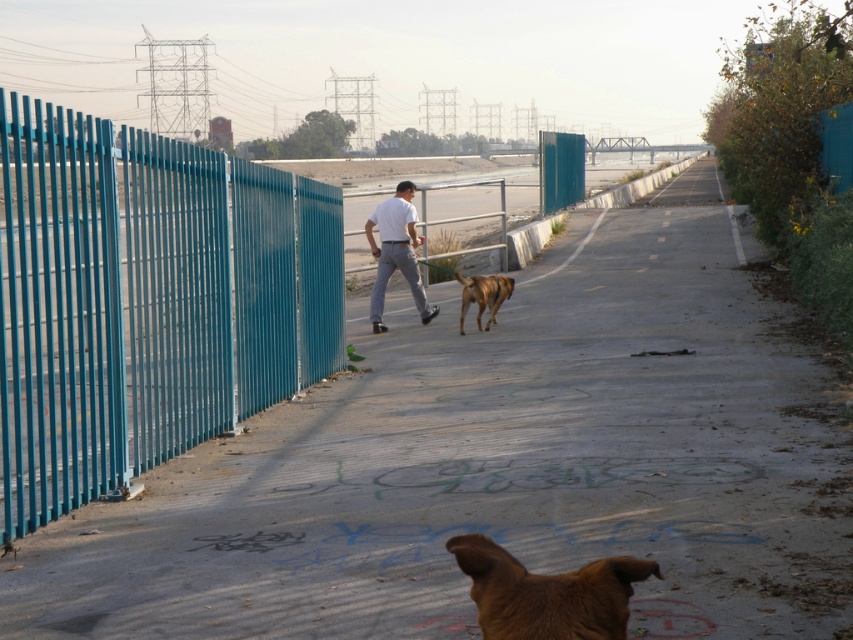
Question: Among these objects, which one is nearest to the camera?

Choices:
 (A) brown furry dog at lower center
 (B) brown fur dog at center

Answer: (A)

Question: Does metallic blue fence at left have a greater width compared to brown furry dog at lower center?

Choices:
 (A) no
 (B) yes

Answer: (A)

Question: Considering the real-world distances, which object is closest to the metallic blue fence at left?

Choices:
 (A) brown furry dog at lower center
 (B) white matte shirt at center

Answer: (A)

Question: Which is nearer to the brown fur dog at center?

Choices:
 (A) metallic blue fence at left
 (B) brown furry dog at lower center
 (C) white matte shirt at center

Answer: (C)

Question: Does metallic blue fence at left appear under brown furry dog at lower center?

Choices:
 (A) no
 (B) yes

Answer: (A)

Question: Can you confirm if brown furry dog at lower center is smaller than brown fur dog at center?

Choices:
 (A) no
 (B) yes

Answer: (B)